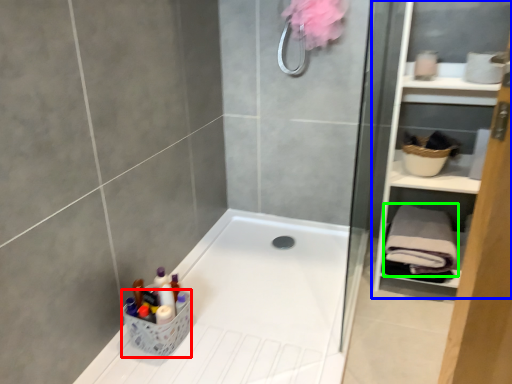
Question: Which object is positioned closest to basket (highlighted by a red box)? Select from cabinet (highlighted by a blue box) and bath towel (highlighted by a green box).

Choices:
 (A) cabinet
 (B) bath towel

Answer: (B)